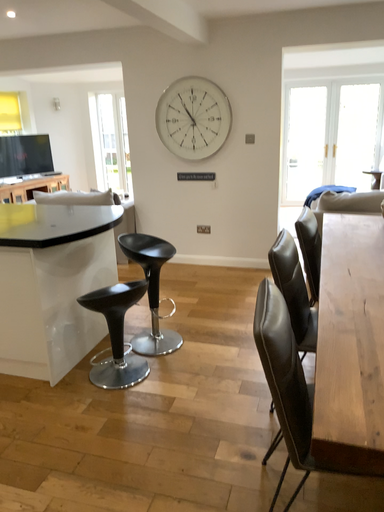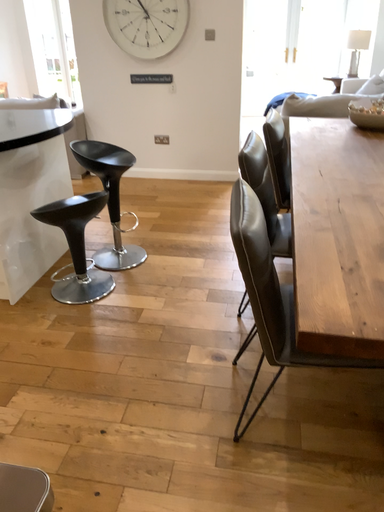
Question: How did the camera likely rotate when shooting the video?

Choices:
 (A) rotated right
 (B) rotated left

Answer: (A)